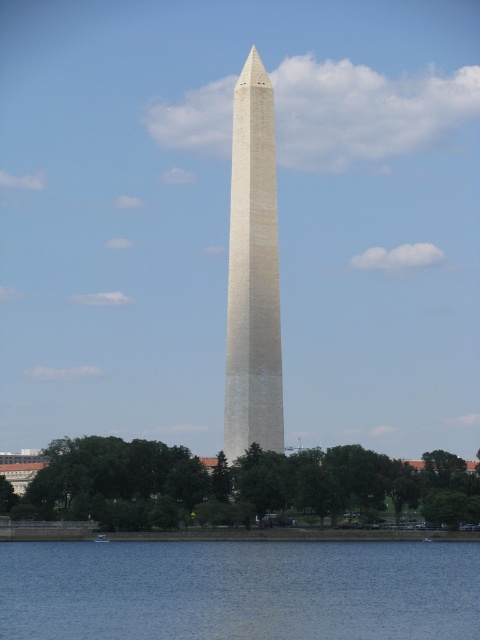
You are standing at the base of the Washington Monument and want to take a photo of the monument with both the point at coordinates point (x=387, y=483) and point (x=254, y=164) in the frame. Based on their positions, which point will appear closer to the camera in your photo?

Point (x=387, y=483) will appear closer to the camera in the photo because it is positioned in front of point (x=254, y=164) according to the spatial relationship provided.

You are a photographer planning to capture the Washington Monument with both the blue water at lower center and the green leafy tree at center in the same frame. Based on their sizes in the image, which object should you focus on to ensure both are visible without cropping?

The blue water at lower center is thinner than the green leafy tree at center, so focusing on the green leafy tree at center would allow both objects to fit in the frame since it occupies more space.

You are standing at the Tidal Basin looking towards the Washington Monument. Which object is positioned lower in the scene, the blue water at lower center or the white stone obelisk at center?

The blue water at lower center is positioned below the white stone obelisk at center, so it is lower in the scene.